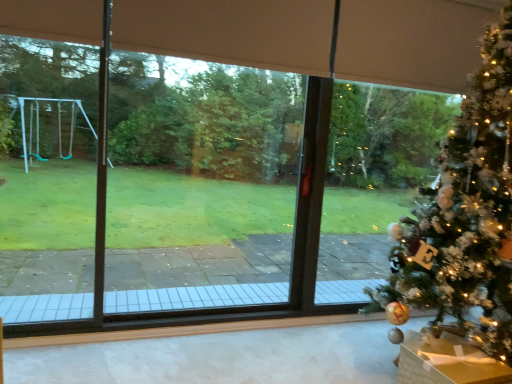
Question: Are metallic gold ornament at lower right and white fluffy christmas tree at right making contact?

Choices:
 (A) no
 (B) yes

Answer: (A)

Question: From the image's perspective, would you say metallic gold ornament at lower right is positioned over white fluffy christmas tree at right?

Choices:
 (A) no
 (B) yes

Answer: (A)

Question: Is metallic gold ornament at lower right further to the viewer compared to white fluffy christmas tree at right?

Choices:
 (A) yes
 (B) no

Answer: (A)

Question: Is metallic gold ornament at lower right thinner than white fluffy christmas tree at right?

Choices:
 (A) yes
 (B) no

Answer: (A)

Question: Is the depth of metallic gold ornament at lower right less than that of white fluffy christmas tree at right?

Choices:
 (A) yes
 (B) no

Answer: (B)

Question: Is metallic gold ornament at lower right at the left side of white fluffy christmas tree at right?

Choices:
 (A) yes
 (B) no

Answer: (A)

Question: From the image's perspective, is white fluffy christmas tree at right on top of metallic gold ornament at lower right?

Choices:
 (A) no
 (B) yes

Answer: (B)

Question: Does white fluffy christmas tree at right contain metallic gold ornament at lower right?

Choices:
 (A) yes
 (B) no

Answer: (A)

Question: Considering the relative positions of white fluffy christmas tree at right and metallic gold ornament at lower right in the image provided, is white fluffy christmas tree at right to the right of metallic gold ornament at lower right from the viewer's perspective?

Choices:
 (A) no
 (B) yes

Answer: (B)

Question: Considering the relative sizes of white fluffy christmas tree at right and metallic gold ornament at lower right in the image provided, is white fluffy christmas tree at right thinner than metallic gold ornament at lower right?

Choices:
 (A) no
 (B) yes

Answer: (A)

Question: Does white fluffy christmas tree at right appear on the left side of metallic gold ornament at lower right?

Choices:
 (A) no
 (B) yes

Answer: (A)

Question: Is white fluffy christmas tree at right outside of metallic gold ornament at lower right?

Choices:
 (A) yes
 (B) no

Answer: (A)

Question: From the image's perspective, is white fluffy christmas tree at right positioned above or below metallic gold ornament at lower right?

Choices:
 (A) above
 (B) below

Answer: (A)